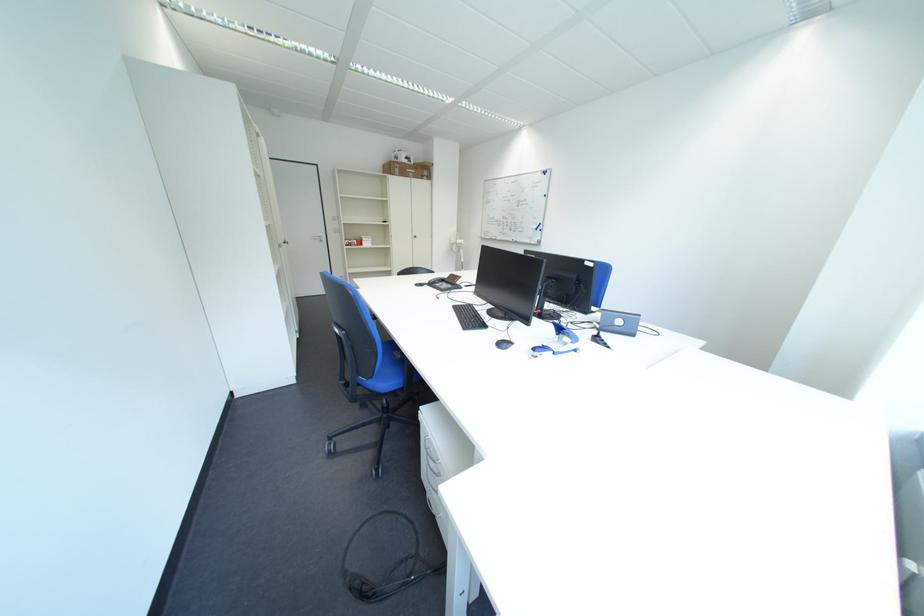
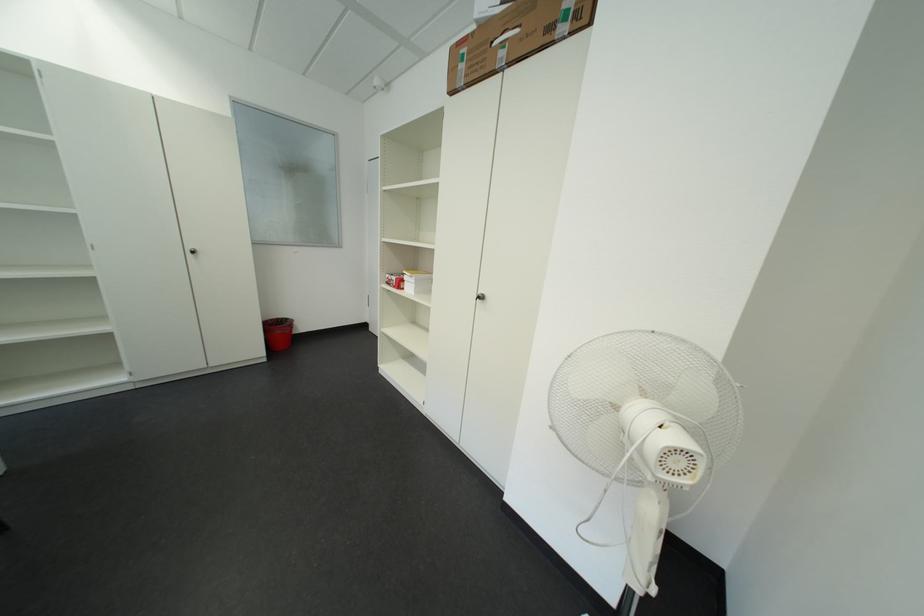
In the second image, find the point that corresponds to [372,246] in the first image.

(411, 286)